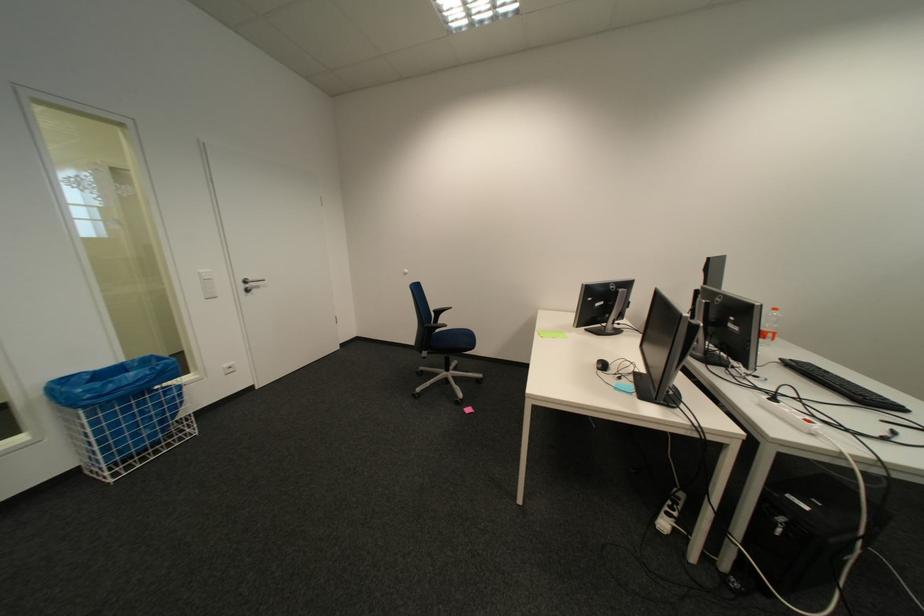
Image resolution: width=924 pixels, height=616 pixels. I want to click on silver door handle, so click(x=250, y=284).